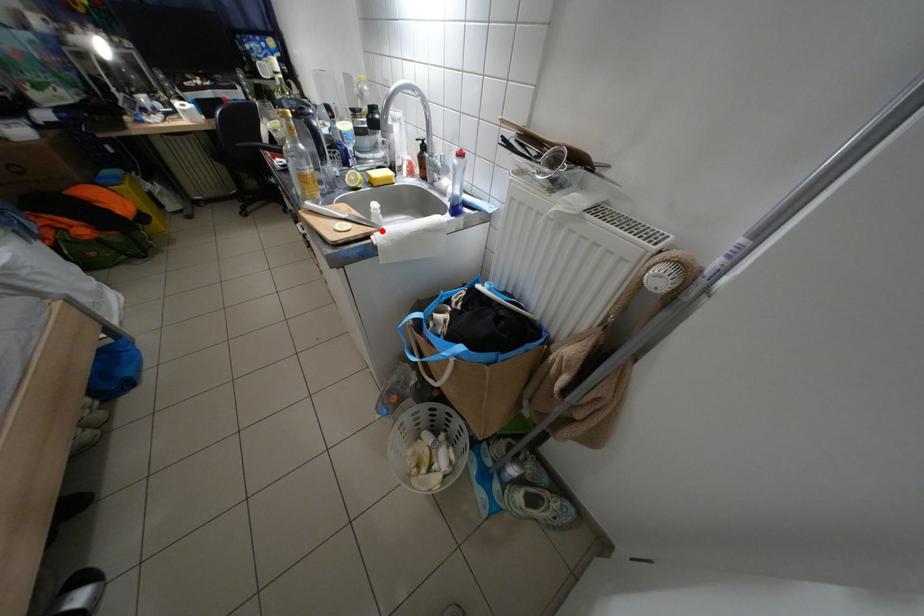
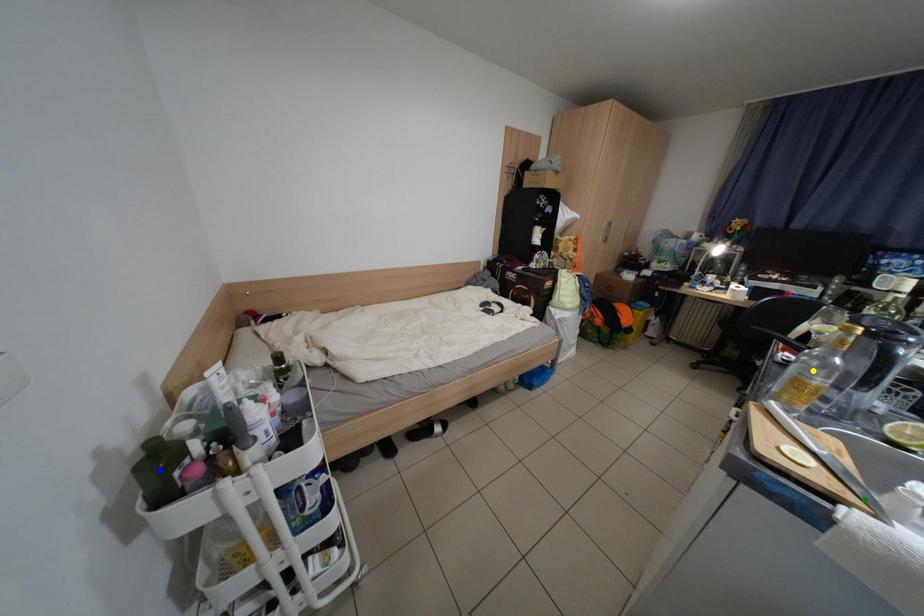
Question: I am providing you with two images of the same scene from different viewpoints. A red point is marked on the first image. You are given multiple points on the second image. Which mark in image 2 goes with the point in image 1?

Choices:
 (A) blue point
 (B) yellow point
 (C) green point

Answer: (C)